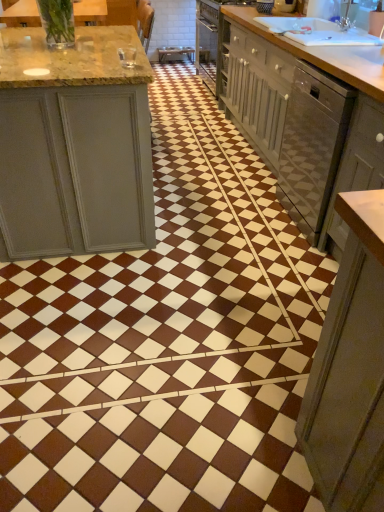
Question: Considering the relative positions of matte gray cabinet at right and translucent glass vase at upper left, arranged as the 2th countertop when viewed from the right, in the image provided, is matte gray cabinet at right to the left of translucent glass vase at upper left, arranged as the 2th countertop when viewed from the right, from the viewer's perspective?

Choices:
 (A) yes
 (B) no

Answer: (B)

Question: From the image's perspective, is matte gray cabinet at right below translucent glass vase at upper left, arranged as the 2th countertop when viewed from the right?

Choices:
 (A) yes
 (B) no

Answer: (A)

Question: Is matte gray cabinet at right facing away from translucent glass vase at upper left, arranged as the 2th countertop when viewed from the right?

Choices:
 (A) no
 (B) yes

Answer: (A)

Question: From the image's perspective, is matte gray cabinet at right on translucent glass vase at upper left, which is counted as the first countertop, starting from the left?

Choices:
 (A) no
 (B) yes

Answer: (A)

Question: Can you confirm if matte gray cabinet at right is taller than translucent glass vase at upper left, which appears as the 2th countertop when viewed from the back?

Choices:
 (A) yes
 (B) no

Answer: (A)

Question: From the image's perspective, is white glossy dishwasher at right positioned above or below translucent glass vase at upper left, arranged as the 2th countertop when viewed from the right?

Choices:
 (A) above
 (B) below

Answer: (B)

Question: Choose the correct answer: Is white glossy dishwasher at right inside translucent glass vase at upper left, which is the 1th countertop from front to back, or outside it?

Choices:
 (A) inside
 (B) outside

Answer: (B)

Question: Is point (286, 119) closer or farther from the camera than point (92, 0)?

Choices:
 (A) closer
 (B) farther

Answer: (B)

Question: Would you say white glossy dishwasher at right is to the left or to the right of translucent glass vase at upper left, which is the 1th countertop from front to back, in the picture?

Choices:
 (A) left
 (B) right

Answer: (B)

Question: Does point (344, 79) appear closer or farther from the camera than point (86, 14)?

Choices:
 (A) closer
 (B) farther

Answer: (A)

Question: Considering their positions, is light brown wood countertop at upper right, acting as the 2th countertop starting from the left, located in front of or behind translucent glass vase at upper left, which is the 1th countertop from front to back?

Choices:
 (A) behind
 (B) front

Answer: (A)

Question: Looking at their shapes, would you say light brown wood countertop at upper right, acting as the 2th countertop starting from the left, is wider or thinner than translucent glass vase at upper left, arranged as the 2th countertop when viewed from the right?

Choices:
 (A) thin
 (B) wide

Answer: (B)

Question: Is light brown wood countertop at upper right, acting as the first countertop starting from the right, taller or shorter than translucent glass vase at upper left, arranged as the 2th countertop when viewed from the right?

Choices:
 (A) tall
 (B) short

Answer: (A)

Question: Considering the positions of translucent glass vase at upper left, which is counted as the first countertop, starting from the left, and light brown wood countertop at upper right, acting as the 2th countertop starting from the left, in the image, is translucent glass vase at upper left, which is counted as the first countertop, starting from the left, wider or thinner than light brown wood countertop at upper right, acting as the 2th countertop starting from the left,?

Choices:
 (A) thin
 (B) wide

Answer: (A)

Question: Is translucent glass vase at upper left, arranged as the 2th countertop when viewed from the right, situated inside light brown wood countertop at upper right, acting as the 2th countertop starting from the left, or outside?

Choices:
 (A) inside
 (B) outside

Answer: (B)